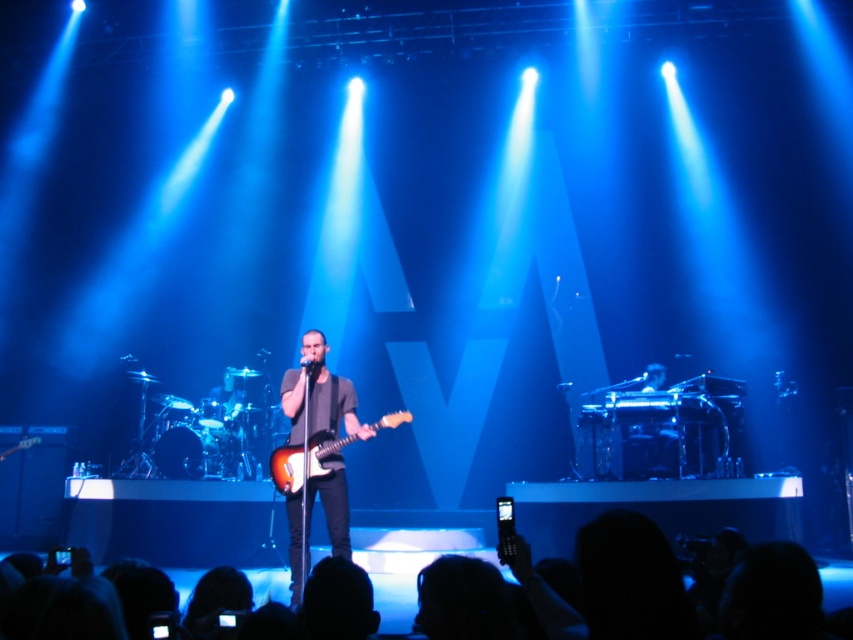
Is satin black guitar at center to the left of silhouette hair at lower center from the viewer's perspective?

Incorrect, satin black guitar at center is not on the left side of silhouette hair at lower center.

Is satin black guitar at center thinner than silhouette hair at lower center?

No, satin black guitar at center is not thinner than silhouette hair at lower center.

Between point (297, 512) and point (851, 595), which one is positioned in front?

Positioned in front is point (851, 595).

You are a GUI agent. You are given a task and a screenshot of the screen. Output one action in this format:
    pyautogui.click(x=<x>, y=<y>)
    Task: Click on the satin black guitar at center
    
    Given the screenshot: What is the action you would take?
    pyautogui.click(x=318, y=396)

Which of these two, satin black guitar at center or sunburst wood electric guitar at center, stands shorter?

sunburst wood electric guitar at center is shorter.

Is point (312, 396) less distant than point (292, 461)?

That is False.

Is point (289, 369) positioned before point (300, 481)?

That is False.

Image resolution: width=853 pixels, height=640 pixels. Identify the location of satin black guitar at center. (318, 396).

Is silhouette hair at lower center below sunburst wood electric guitar at center?

Yes, silhouette hair at lower center is below sunburst wood electric guitar at center.

From the picture: Who is higher up, silhouette hair at lower center or sunburst wood electric guitar at center?

Positioned higher is sunburst wood electric guitar at center.

Is point (409, 572) less distant than point (316, 449)?

No, it is behind (316, 449).

This screenshot has height=640, width=853. What are the coordinates of `silhouette hair at lower center` in the screenshot? It's located at (396, 595).